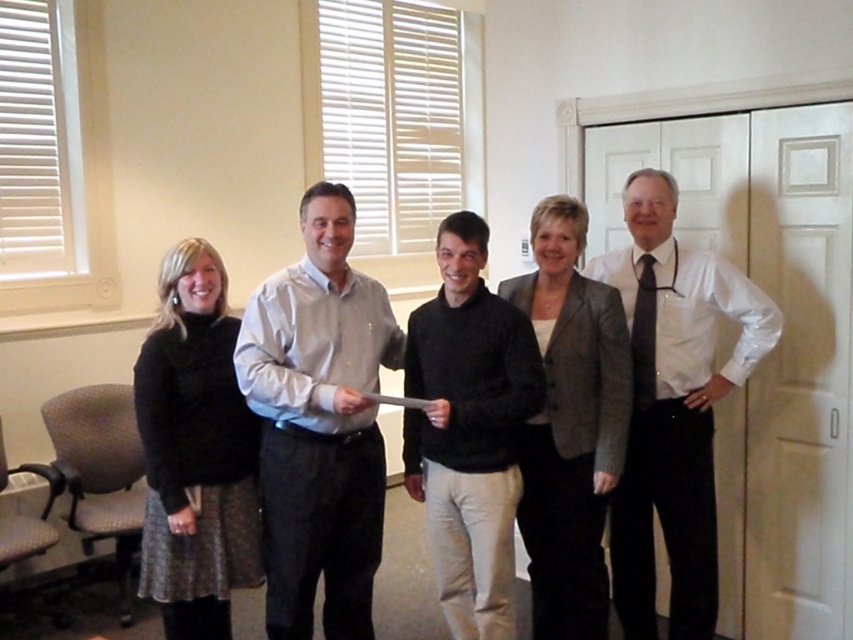
You are an event planner arranging a photo shoot in the room. You need to place a small podium between the white glossy shirt at right and the dark blue silk tie at right. Based on their positions, which object should the podium be closer to?

The podium should be closer to the dark blue silk tie at right because the white glossy shirt at right is further to the viewer than the dark blue silk tie at right, meaning the shirt is closer to the front, and the tie is slightly behind it. Therefore, placing the podium near the tie would maintain a clear path in front of the shirt.

Based on the photo, you are organizing a clothing rack and need to place the black sweater at center and the gray textured blazer at center. The rack has a space that is 12 inches wide. Can both items fit side by side without overlapping?

The black sweater at center and gray textured blazer at center are 11.37 inches apart, so they can fit side by side on the 12 inch wide rack since the total width required is less than the available space.

You are standing in the room and want to take a photo of the white glossy shirt at right. Where should you position yourself to capture it in the frame?

Position yourself facing the right side of the room, as the white glossy shirt at right is located at point (x=676, y=412), which is towards the right side of the frame.